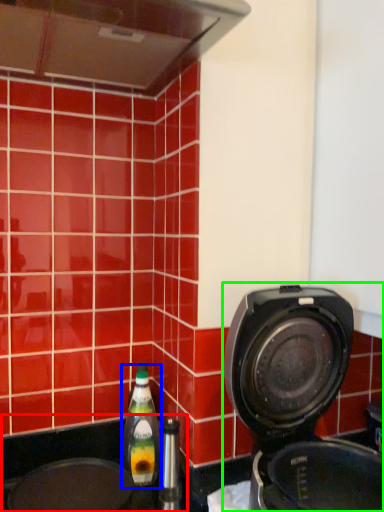
Question: Based on their relative distances, which object is nearer to sink (highlighted by a red box)? Choose from bottle (highlighted by a blue box) and home appliance (highlighted by a green box).

Choices:
 (A) bottle
 (B) home appliance

Answer: (A)